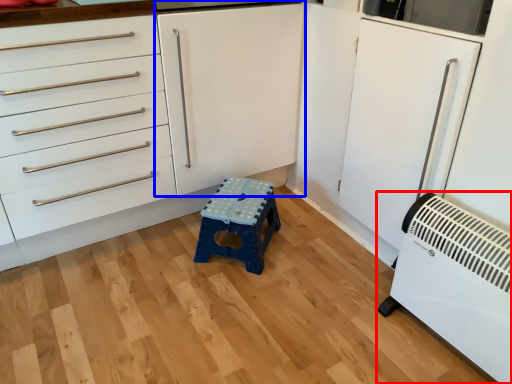
Question: Which object appears farthest to the camera in this image, home appliance (highlighted by a red box) or cabinetry (highlighted by a blue box)?

Choices:
 (A) home appliance
 (B) cabinetry

Answer: (B)